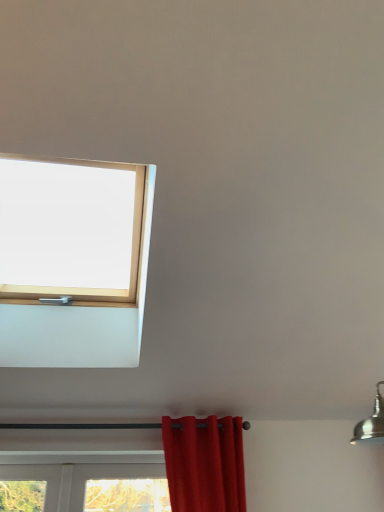
At what (x,y) coordinates should I click in order to perform the action: click on wooden frame at upper left. Please return your answer as a coordinate pair (x, y). Looking at the image, I should click on (73, 261).

What is the approximate width of wooden frame at upper left?

34.52 inches.

This screenshot has width=384, height=512. What do you see at coordinates (73, 261) in the screenshot?
I see `wooden frame at upper left` at bounding box center [73, 261].

Locate an element on the screen. wooden frame at upper left is located at coordinates (73, 261).